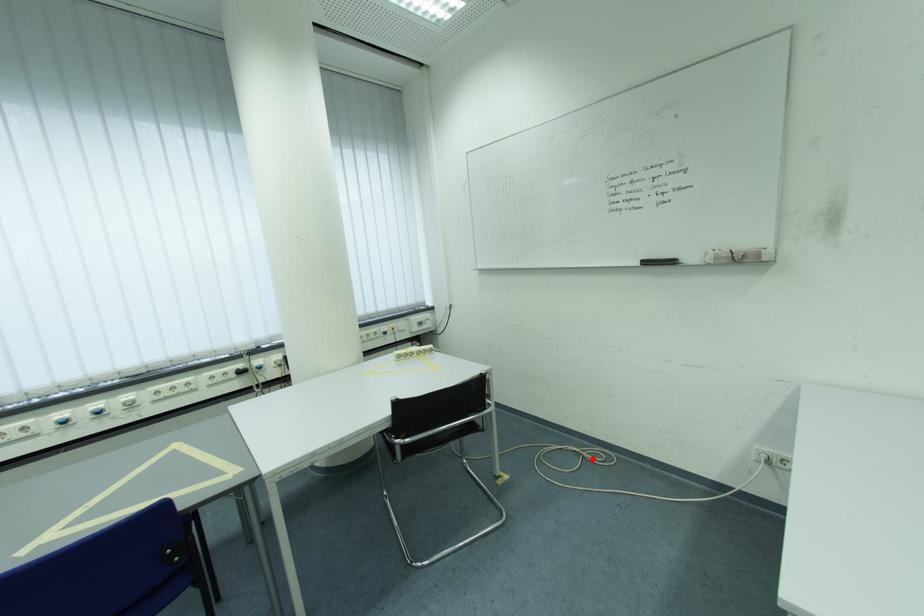
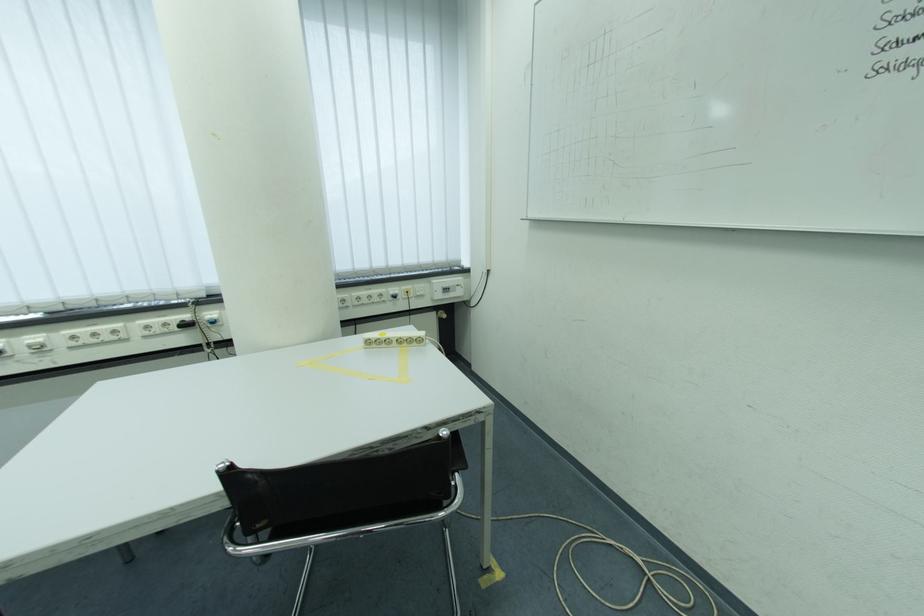
Find the pixel in the second image that matches the highlighted location in the first image.

(659, 582)